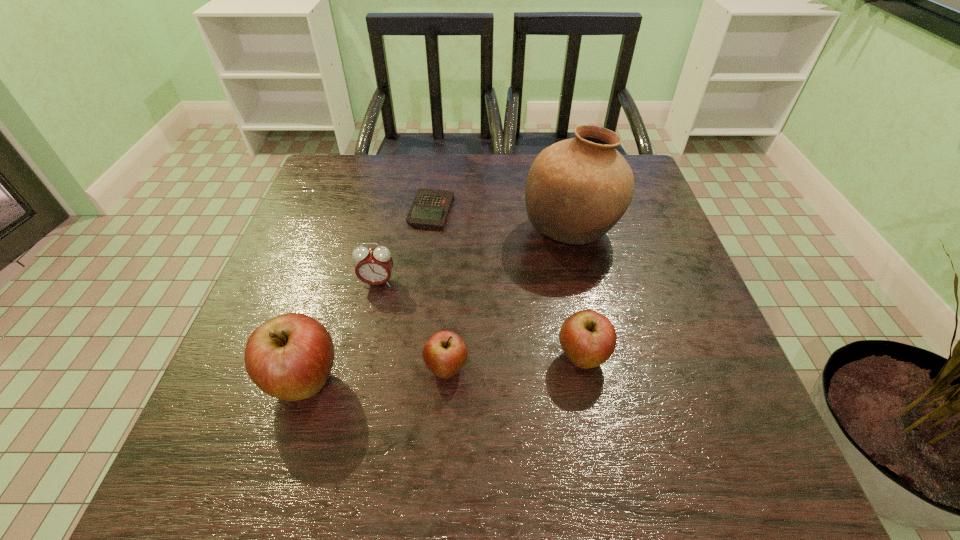
The image size is (960, 540). I want to click on vacant space at the near edge, so click(x=345, y=395).

You are a GUI agent. You are given a task and a screenshot of the screen. Output one action in this format:
    pyautogui.click(x=<x>, y=<y>)
    Task: Click on the vacant region at the left edge of the desktop
    
    Given the screenshot: What is the action you would take?
    pyautogui.click(x=315, y=265)

Locate an element on the screen. This screenshot has height=540, width=960. free location at the right edge is located at coordinates (676, 368).

Find the location of a particular element. vacant area at the far left corner of the desktop is located at coordinates (341, 191).

Image resolution: width=960 pixels, height=540 pixels. In order to click on vacant region between the second shortest apple and the fourth nearest object in this screenshot , I will do `click(480, 320)`.

In order to click on free area in between the alarm clock and the calculator in this screenshot , I will do `click(404, 246)`.

I want to click on vacant space that's between the pottery and the third farthest object, so click(474, 256).

Where is `unoccupied area between the third farthest object and the second apple from right to left`? unoccupied area between the third farthest object and the second apple from right to left is located at coordinates point(412,326).

Locate an element on the screen. This screenshot has width=960, height=540. free space between the pottery and the shortest object is located at coordinates (501, 220).

The height and width of the screenshot is (540, 960). What are the coordinates of `free area in between the pottery and the shortest object` in the screenshot? It's located at (501, 220).